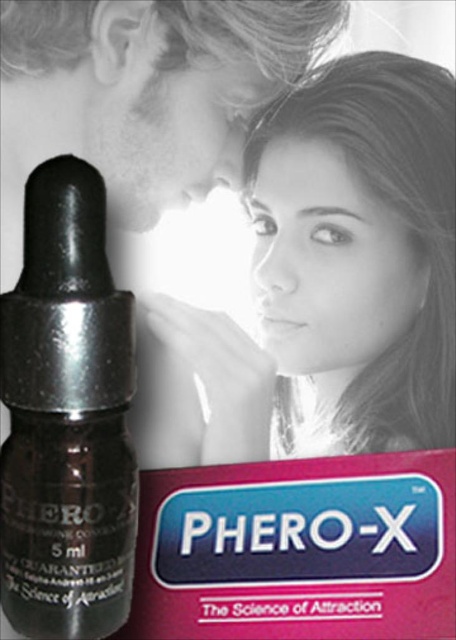
Question: Which object is the closest to the matte black lipstick at center?

Choices:
 (A) shiny black glass dropper at center-left
 (B) smooth skin face at upper center

Answer: (B)

Question: Can you confirm if smooth skin face at upper center is positioned below matte black lipstick at center?

Choices:
 (A) no
 (B) yes

Answer: (A)

Question: Where is smooth skin face at upper center located in relation to shiny black glass dropper at center-left in the image?

Choices:
 (A) above
 (B) below

Answer: (A)

Question: Can you confirm if smooth skin face at upper center is smaller than matte black lipstick at center?

Choices:
 (A) no
 (B) yes

Answer: (A)

Question: Which of the following is the farthest from the observer?

Choices:
 (A) (298, 316)
 (B) (83, 224)

Answer: (A)

Question: Which of the following is the farthest from the observer?

Choices:
 (A) [269, 131]
 (B) [122, 481]

Answer: (A)